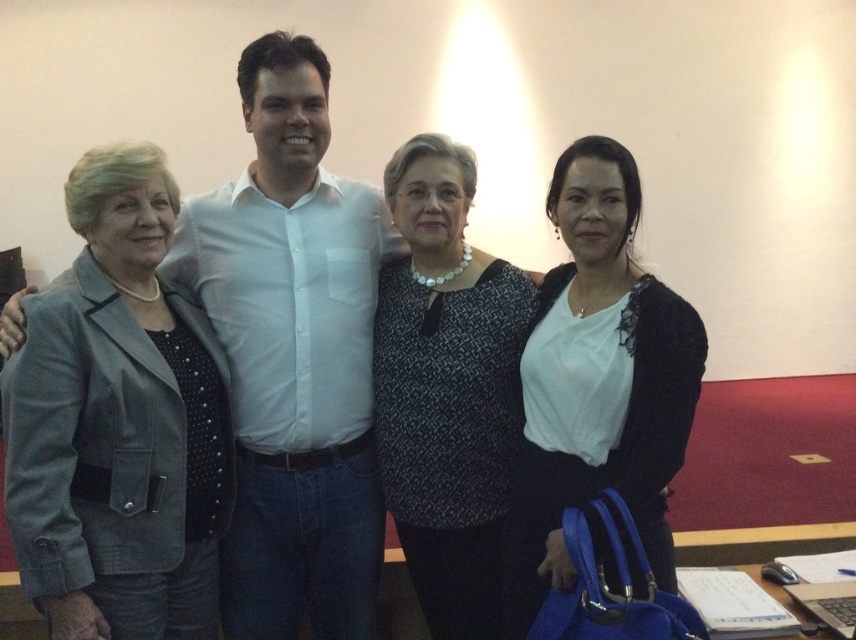
Where is the gray fabric jacket at left located in the image?

The gray fabric jacket at left is located at point (117, 422) in the image.

Based on the photo, you are a photographer trying to focus on the white matte shirt at center and the patterned fabric blouse at center. Which one should you adjust your camera focus to first if you want to capture both clearly?

The white matte shirt at center is closer to the viewer than the patterned fabric blouse at center, so focus on the white matte shirt at center first to ensure both are in focus.